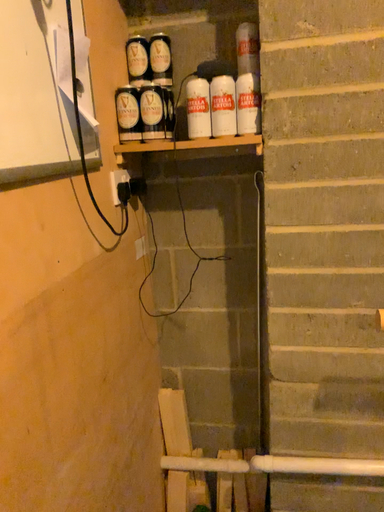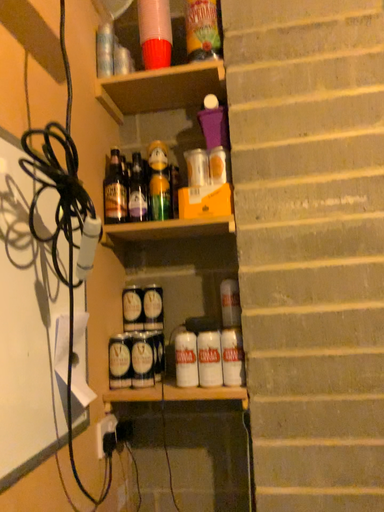
Question: How did the camera likely rotate when shooting the video?

Choices:
 (A) rotated downward
 (B) rotated upward

Answer: (B)